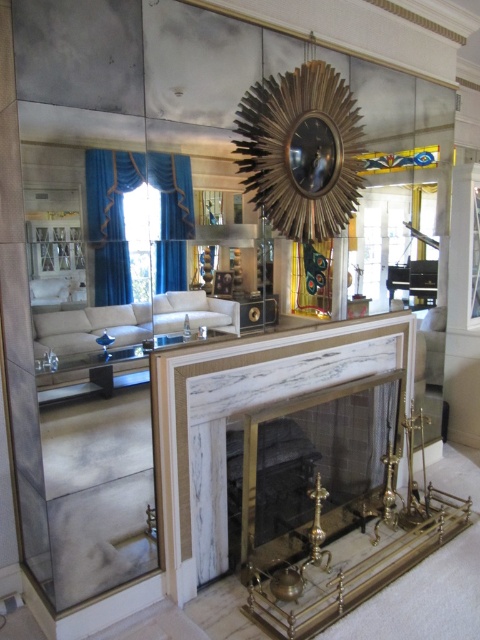
You are standing in the luxurious interior space and want to move from the point at coordinates point (x=252, y=432) to the point at coordinates point (x=255, y=141). Which direction should you move to reach your destination?

You should move towards the left because point (x=252, y=432) is behind point (x=255, y=141), indicating that moving left will bring you closer to the destination.